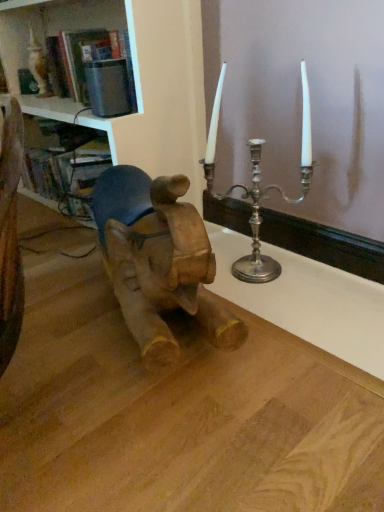
The image size is (384, 512). In order to click on vacant space that is to the left of wooden baby elephant at left in this screenshot , I will do `click(60, 317)`.